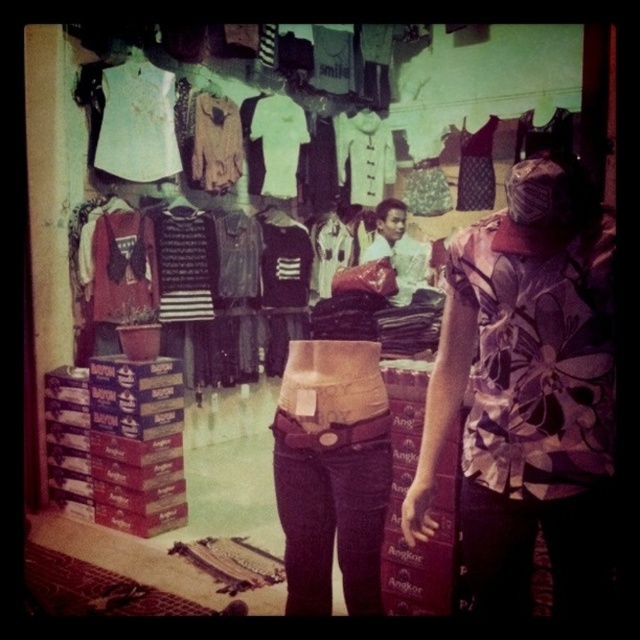
You are a customer at this market and want to buy both the white matte shirt at upper left and the light brown fabric shirt at upper center. However, you notice that one of them is partially hidden. Which shirt is more visible to you?

The white matte shirt at upper left is more visible because it is in front of the light brown fabric shirt at upper center.

Based on the scene description, you need to determine which clothing item is larger. The scene shows a mannequin with two light brown items. Which is larger, the light brown fabric shirt at upper center or the light brown leather jacket at center?

The light brown leather jacket at center is larger than the light brown fabric shirt at upper center.